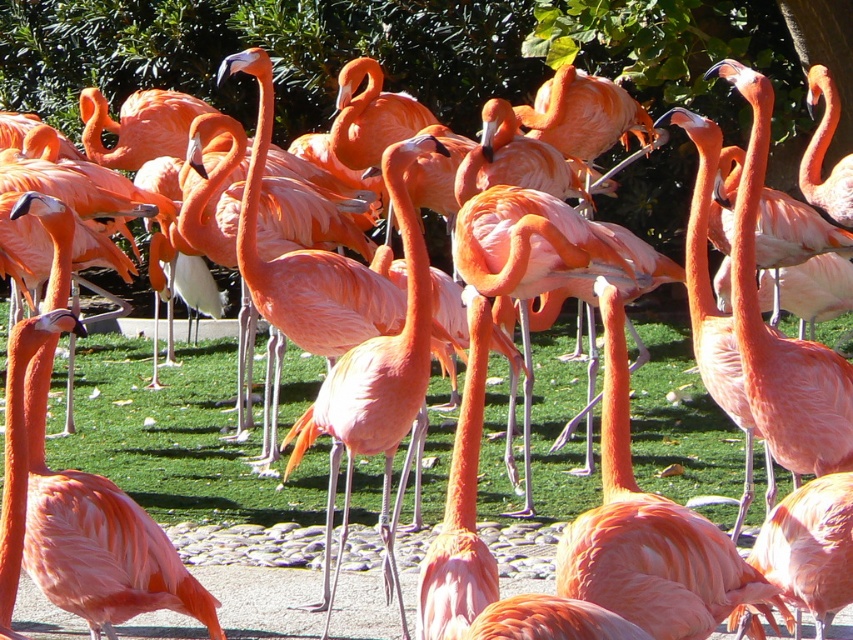
Is green grass at center behind matte pink flamingo at center?

Yes, green grass at center is behind matte pink flamingo at center.

Is green grass at center to the right of matte pink flamingo at center from the viewer's perspective?

Indeed, green grass at center is positioned on the right side of matte pink flamingo at center.

Locate an element on the screen. Image resolution: width=853 pixels, height=640 pixels. green grass at center is located at coordinates (177, 440).